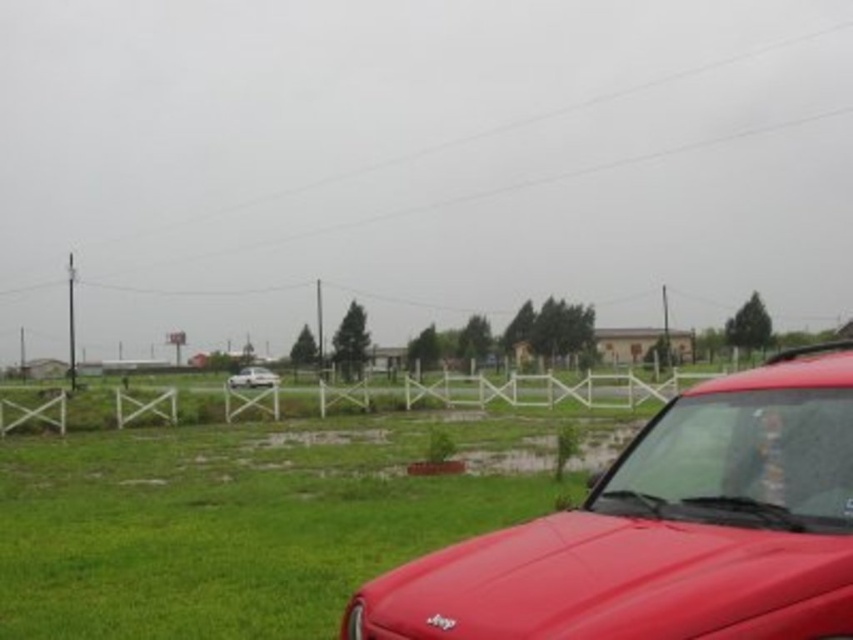
Question: Which object appears closest to the camera in this image?

Choices:
 (A) shiny red car at lower right
 (B) white matte sedan at center

Answer: (A)

Question: Is shiny red car at lower right above white matte sedan at center?

Choices:
 (A) yes
 (B) no

Answer: (A)

Question: Is shiny red car at lower right further to the viewer compared to white matte sedan at center?

Choices:
 (A) yes
 (B) no

Answer: (B)

Question: Is shiny red car at lower right smaller than white matte sedan at center?

Choices:
 (A) no
 (B) yes

Answer: (A)